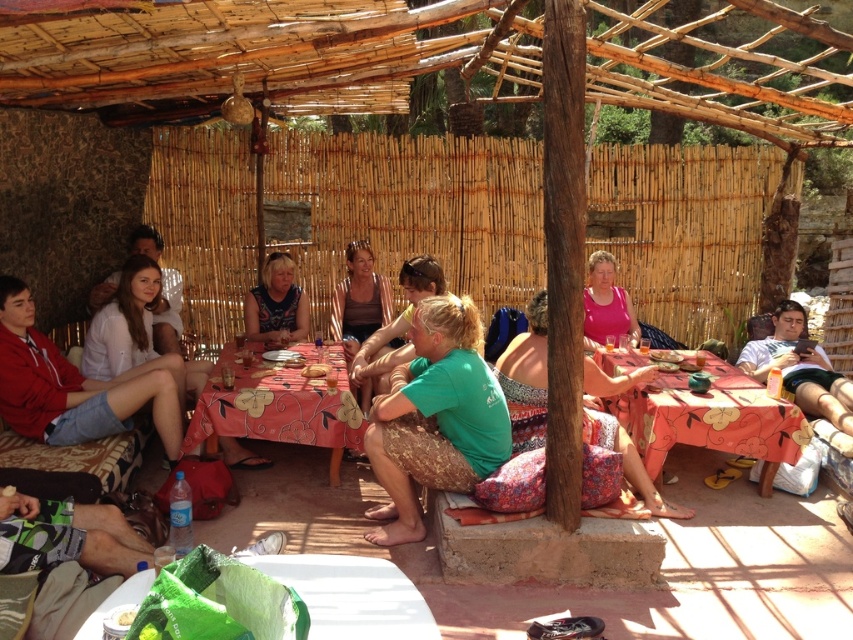
What do you see at coordinates (434, 417) in the screenshot?
I see `green fabric pants at center` at bounding box center [434, 417].

Does green fabric pants at center have a larger size compared to green fabric at center?

Yes, green fabric pants at center is bigger than green fabric at center.

The height and width of the screenshot is (640, 853). Describe the element at coordinates (434, 417) in the screenshot. I see `green fabric pants at center` at that location.

At what (x,y) coordinates should I click in order to perform the action: click on green fabric pants at center. Please return your answer as a coordinate pair (x, y). Looking at the image, I should click on (434, 417).

Who is more forward, [358,372] or [321,369]?

Point [321,369] is more forward.

Is point (409, 289) positioned in front of point (309, 372)?

No, (409, 289) is further to viewer.

Image resolution: width=853 pixels, height=640 pixels. I want to click on green fabric at center, so click(397, 324).

Consider the image. How distant is floral fabric table at center from blue printed dress at center?

floral fabric table at center and blue printed dress at center are 2.96 meters apart from each other.

Does floral fabric table at center have a larger size compared to blue printed dress at center?

Correct, floral fabric table at center is larger in size than blue printed dress at center.

Image resolution: width=853 pixels, height=640 pixels. What are the coordinates of `floral fabric table at center` in the screenshot? It's located at (709, 417).